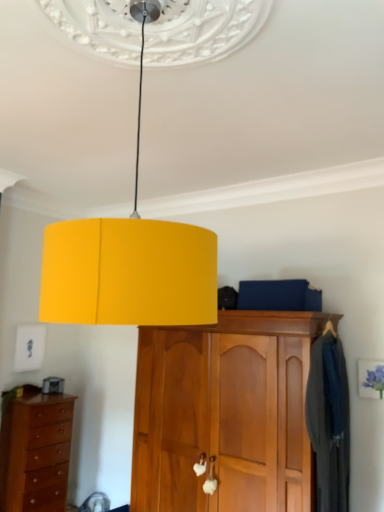
Question: Is yellow matte lampshade at center inside or outside of brown wooden chest of drawers at lower left?

Choices:
 (A) inside
 (B) outside

Answer: (B)

Question: From the image's perspective, is yellow matte lampshade at center located above or below brown wooden chest of drawers at lower left?

Choices:
 (A) below
 (B) above

Answer: (B)

Question: Estimate the real-world distances between objects in this image. Which object is farther from the dark blue fabric coat at right?

Choices:
 (A) wooden cabinet at center
 (B) yellow matte lampshade at center
 (C) brown wooden chest of drawers at lower left

Answer: (C)

Question: Considering the real-world distances, which object is closest to the yellow matte lampshade at center?

Choices:
 (A) wooden cabinet at center
 (B) dark blue fabric coat at right
 (C) brown wooden chest of drawers at lower left

Answer: (B)